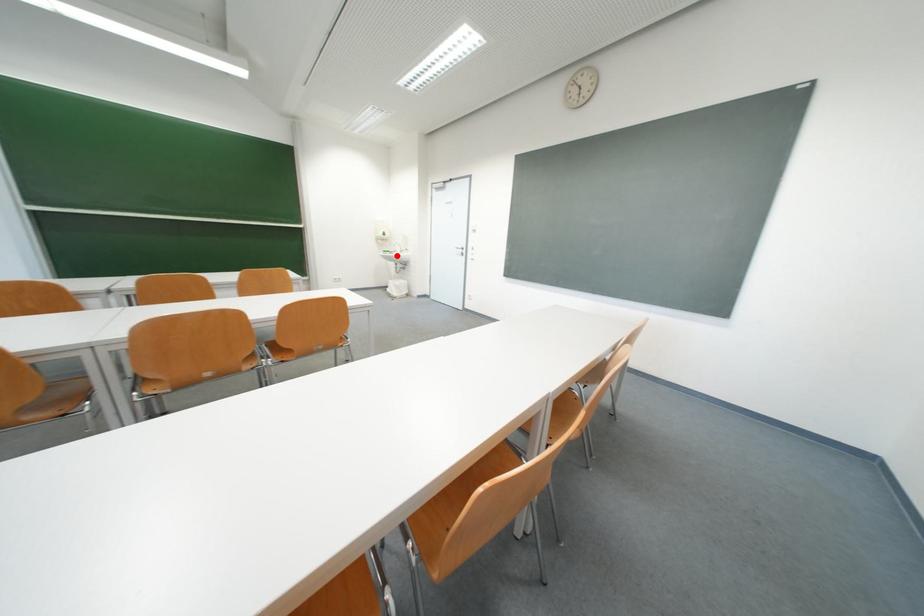
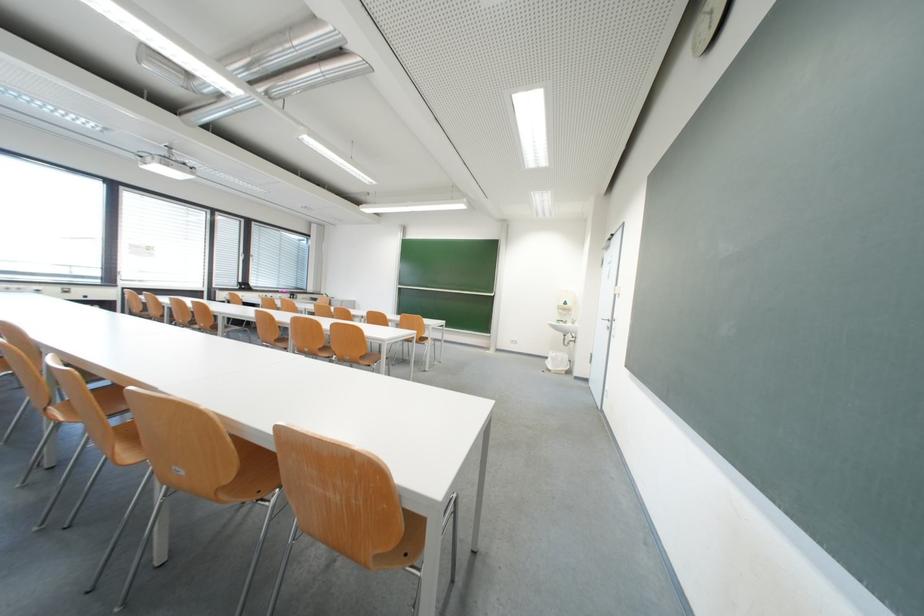
Find the pixel in the second image that matches the highlighted location in the first image.

(570, 326)